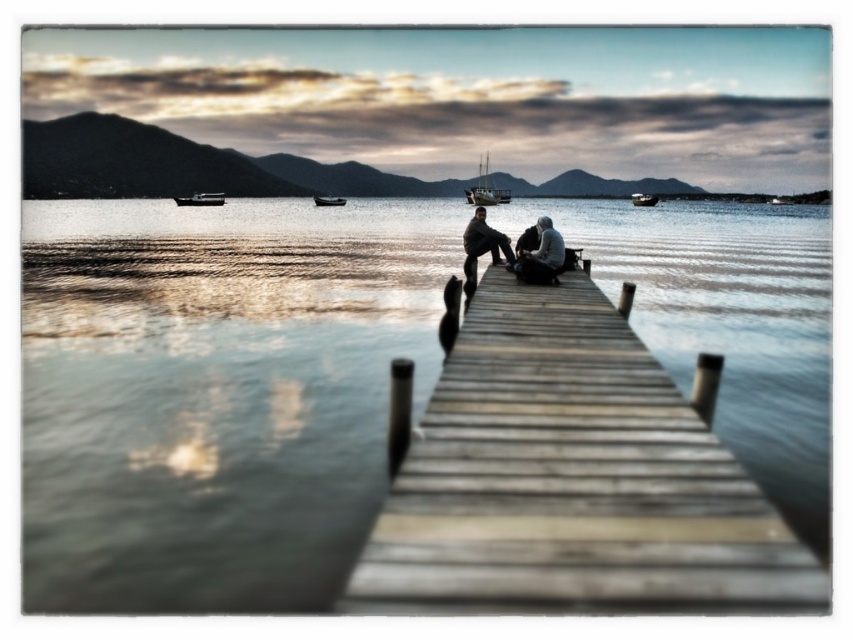
You are standing on the wooden pier in the lakeside scene. You want to locate the matte gray clothing at center. Where exactly should you look?

The matte gray clothing at center is located at point (517, 250).

You are standing at the center of the wooden pier and want to place a small decorative item exactly where the matte gray clothing at center is located. What are the coordinates you should aim for?

The coordinates for the matte gray clothing at center are at point (517, 250), so you should aim for those coordinates.

You are standing on the wooden pier and want to place a small potted plant between the matte gray clothing at center and the metallic gray boat at lower left. Which object should you place it closer to if the plant is only 10 cm tall?

The matte gray clothing at center is shorter than the metallic gray boat at lower left, so the plant should be placed closer to the matte gray clothing at center to ensure visibility.